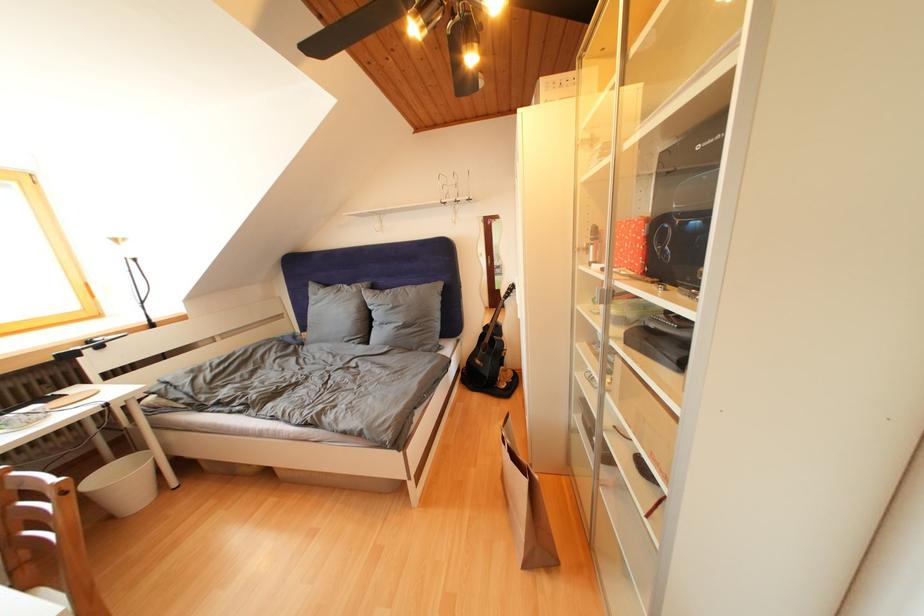
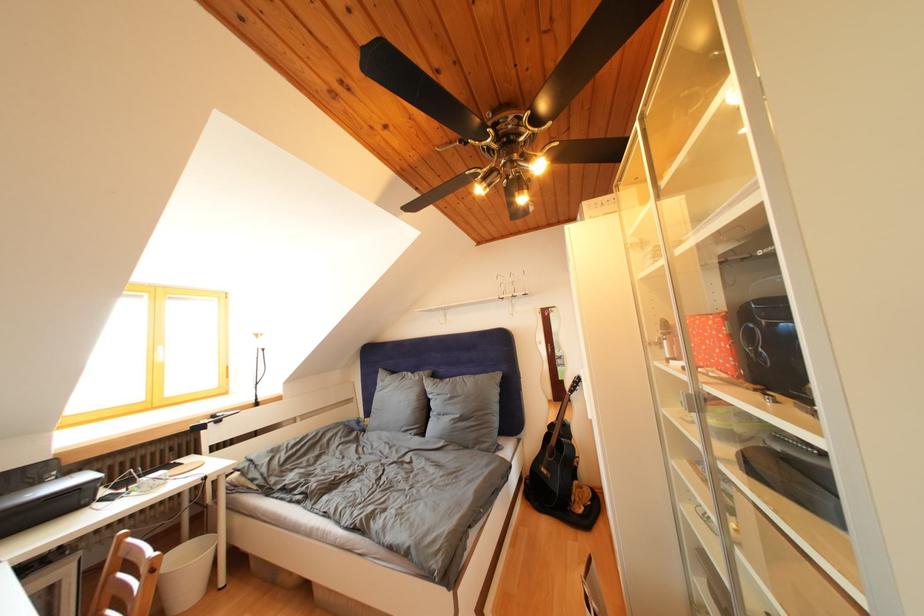
Locate, in the second image, the point that corresponds to the point at 648,267 in the first image.

(737, 368)